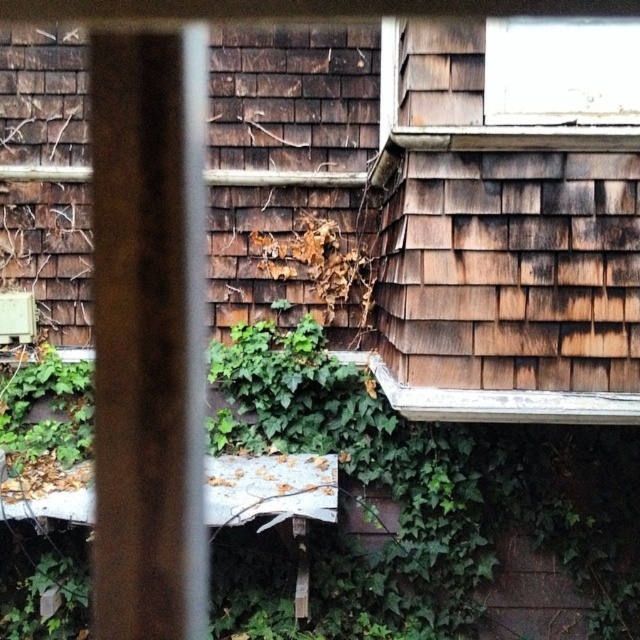
Question: Is white painted wood window at upper right to the right of transparent glass window at upper center from the viewer's perspective?

Choices:
 (A) no
 (B) yes

Answer: (A)

Question: Which point appears closest to the camera in this image?

Choices:
 (A) (614, 132)
 (B) (566, 36)

Answer: (A)

Question: Can you confirm if white painted wood window at upper right is thinner than transparent glass window at upper center?

Choices:
 (A) yes
 (B) no

Answer: (B)

Question: Can you confirm if white painted wood window at upper right is positioned to the right of transparent glass window at upper center?

Choices:
 (A) no
 (B) yes

Answer: (A)

Question: Which point appears farthest from the camera in this image?

Choices:
 (A) (627, 28)
 (B) (508, 72)

Answer: (B)